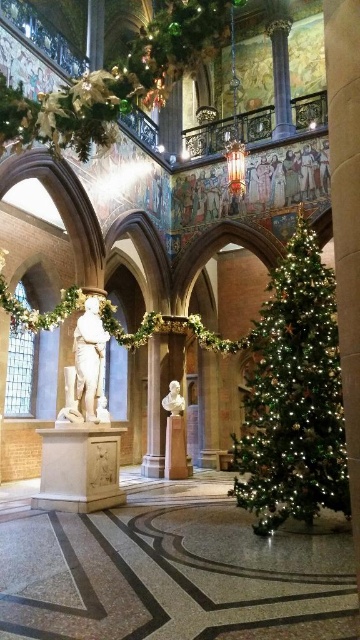
You are an interior designer planning to place a new sofa in this room. The sofa will be placed between the green matte christmas tree at right and the green leafy garland at upper center. Considering their widths, which object should you position closer to the sofa to ensure there is enough space for people to walk comfortably?

The green matte christmas tree at right has a lesser width compared to the green leafy garland at upper center, so positioning the sofa closer to the green matte christmas tree at right would leave more space for walking, as it takes up less horizontal space.

You are an interior designer planning to hang a new decoration. You see the green leafy garland at upper center and the white marble statue at center. Which object is taller and requires more vertical space?

The green leafy garland at upper center is taller than the white marble statue at center, so it requires more vertical space.

You are an interior designer planning to place a new sofa in this room. The sofa will be positioned between the green matte christmas tree at right and the green leafy garland at upper center. Considering their sizes, which object should you place closer to the sofa to ensure it doesn

The green matte christmas tree at right has a smaller size compared to the green leafy garland at upper center. Therefore, to ensure proper spacing, the sofa should be placed closer to the green matte christmas tree at right since it is smaller and requires less space.